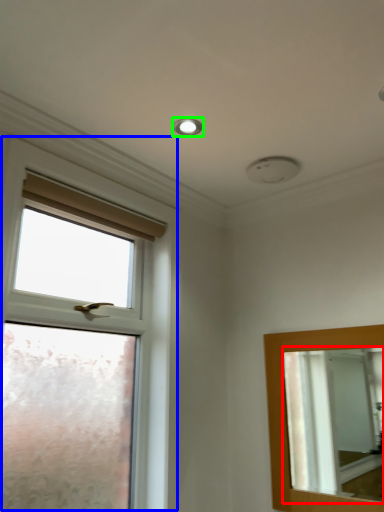
Question: Which object is positioned farthest from mirror (highlighted by a red box)? Select from window (highlighted by a blue box) and droplight (highlighted by a green box).

Choices:
 (A) window
 (B) droplight

Answer: (B)